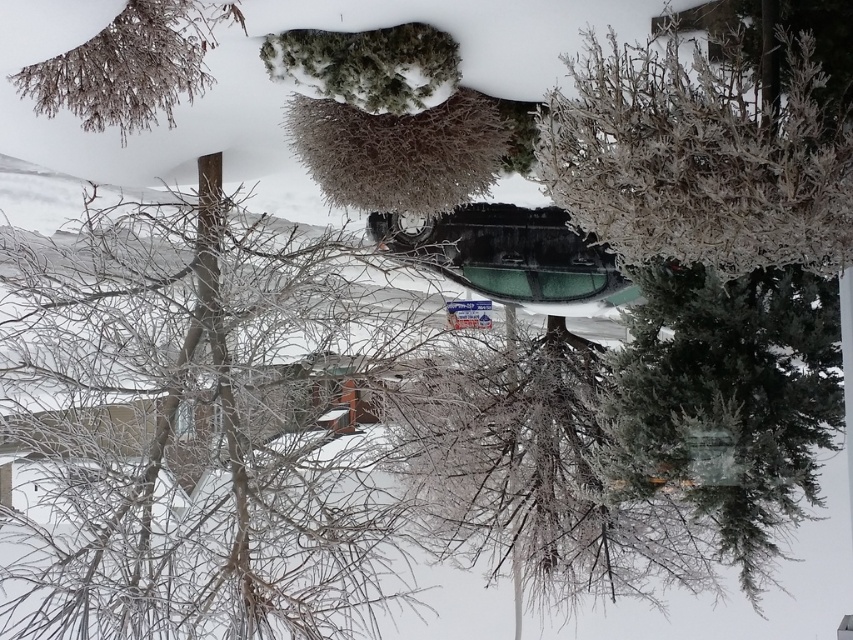
Question: Which point is farther to the camera?

Choices:
 (A) (755, 212)
 (B) (44, 100)

Answer: (B)

Question: Among these points, which one is nearest to the camera?

Choices:
 (A) (122, 83)
 (B) (809, 40)

Answer: (B)

Question: Is frosted white tree at center closer to the viewer compared to frosted brown branches at upper left?

Choices:
 (A) no
 (B) yes

Answer: (B)

Question: Does frosted white tree at center appear over frosted brown branches at upper left?

Choices:
 (A) no
 (B) yes

Answer: (A)

Question: Which of the following is the farthest from the observer?

Choices:
 (A) (579, 138)
 (B) (96, 44)

Answer: (B)

Question: Is frosted white tree at center closer to camera compared to frosted brown branches at upper left?

Choices:
 (A) yes
 (B) no

Answer: (A)